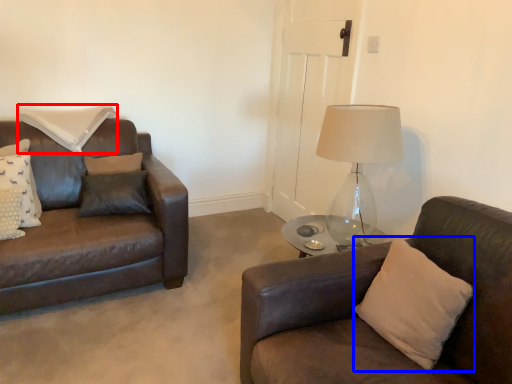
Question: Which point is further to the camera, pillow (highlighted by a red box) or pillow (highlighted by a blue box)?

Choices:
 (A) pillow
 (B) pillow

Answer: (A)